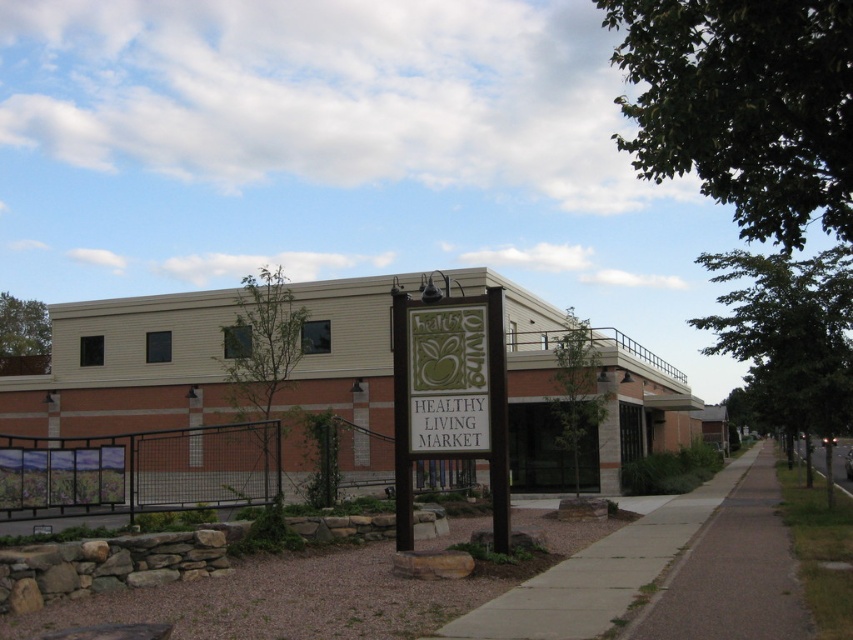
You are a delivery person trying to park your bike near the Healthy Living Market entrance. The bike requires 2 square meters of space. Given that the gray asphalt sidewalk at lower right and the green fabric sign at center are both on the ground, which location would allow you to park your bike without overlapping any objects?

The gray asphalt sidewalk at lower right has a larger size compared to the green fabric sign at center, so you can park your bike on the gray asphalt sidewalk at lower right as it provides enough space for the bike without overlapping any objects.

Based on the photo, you are standing on the sidewalk and want to read the brown wooden sign at center. Is the sign closer to you than the concrete sidewalk at center?

The brown wooden sign at center is further to the viewer than the concrete sidewalk at center, so the sign is actually farther away from you than the sidewalk.